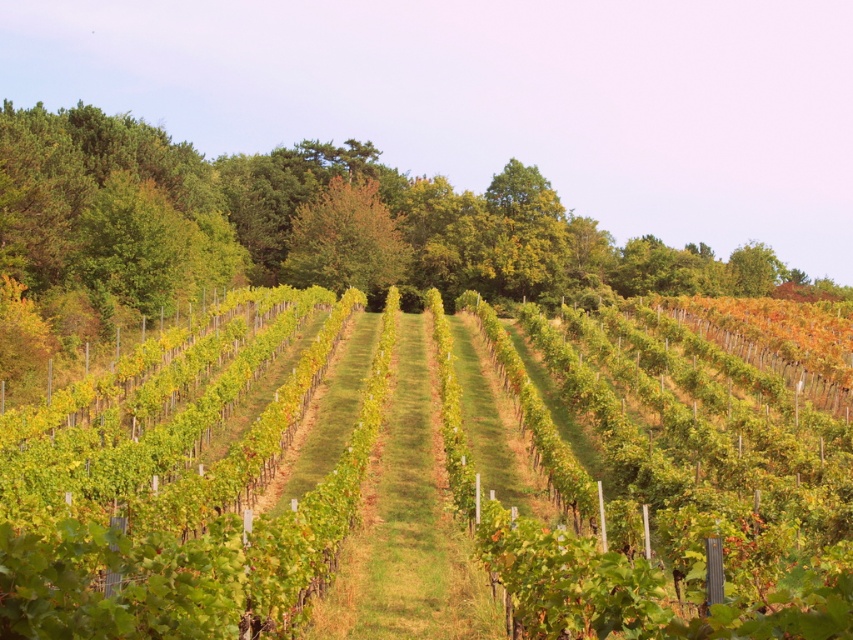
Does green leafy vines at center appear on the right side of green leafy tree at center?

Indeed, green leafy vines at center is positioned on the right side of green leafy tree at center.

Is point (28, 518) closer to viewer compared to point (302, 266)?

Yes.

Find the location of a particular element. This screenshot has width=853, height=640. green leafy vines at center is located at coordinates (650, 484).

You are a GUI agent. You are given a task and a screenshot of the screen. Output one action in this format:
    pyautogui.click(x=<x>, y=<y>)
    Task: Click on the green leafy vines at center
    The image size is (853, 640).
    Given the screenshot: What is the action you would take?
    pyautogui.click(x=650, y=484)